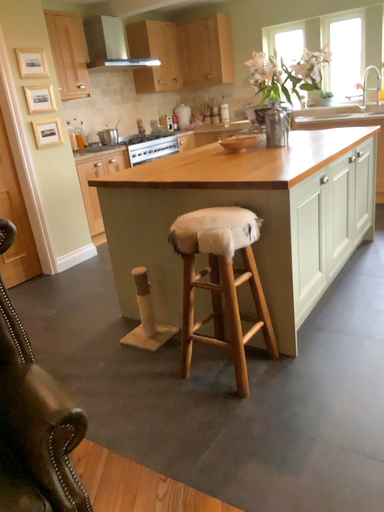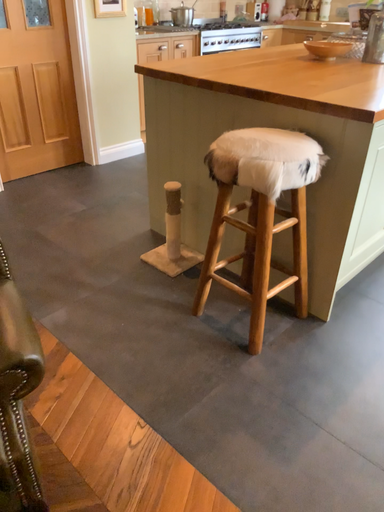
Question: Which way did the camera rotate in the video?

Choices:
 (A) rotated downward
 (B) rotated upward

Answer: (A)